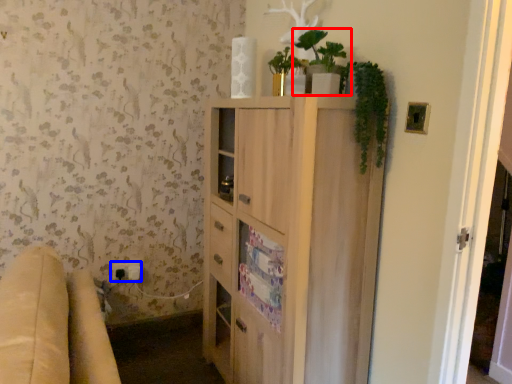
Question: Which of the following is the farthest to the observer, houseplant (highlighted by a red box) or electric outlet (highlighted by a blue box)?

Choices:
 (A) houseplant
 (B) electric outlet

Answer: (B)